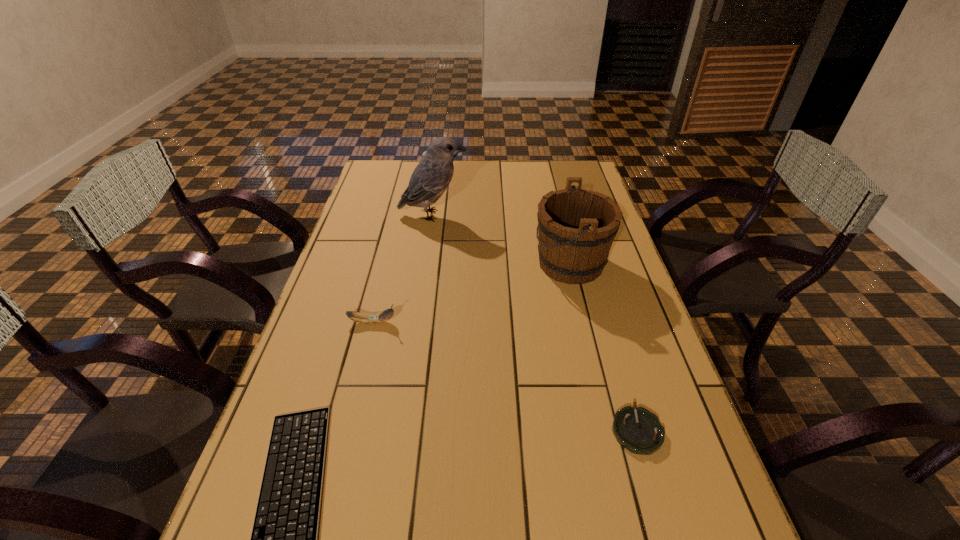
Identify which object is the fifth nearest to the second tallest object. Please provide its 2D coordinates. Your answer should be formatted as a tuple, i.e. [(x, y)], where the tuple contains the x and y coordinates of a point satisfying the conditions above.

[(284, 536)]

The image size is (960, 540). Find the location of `free space that satisfies the following two spatial constraints: 1. on the side of the wine bucket with the handle for carrying; 2. on the left side of the ashtray`. free space that satisfies the following two spatial constraints: 1. on the side of the wine bucket with the handle for carrying; 2. on the left side of the ashtray is located at coordinates (612, 430).

I want to click on vacant space that satisfies the following two spatial constraints: 1. on the side of the second shortest object with the handle; 2. on the left side of the farthest object, so click(390, 430).